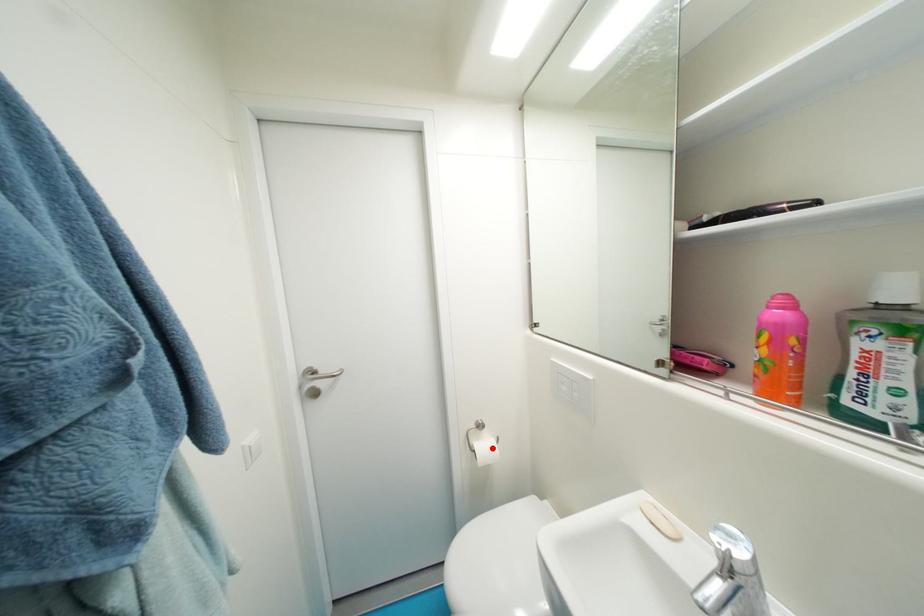
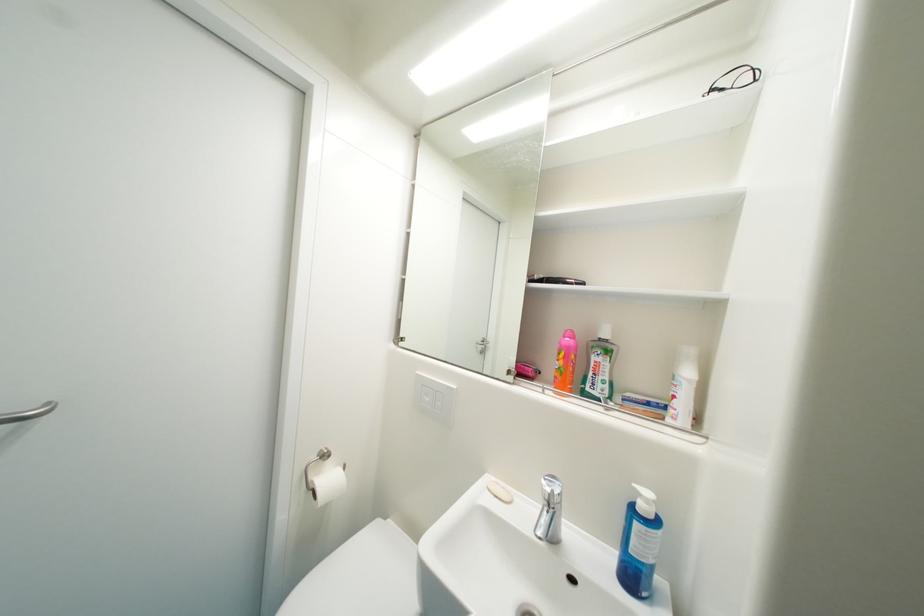
Locate, in the second image, the point that corresponds to the highlighted location in the first image.

(337, 482)